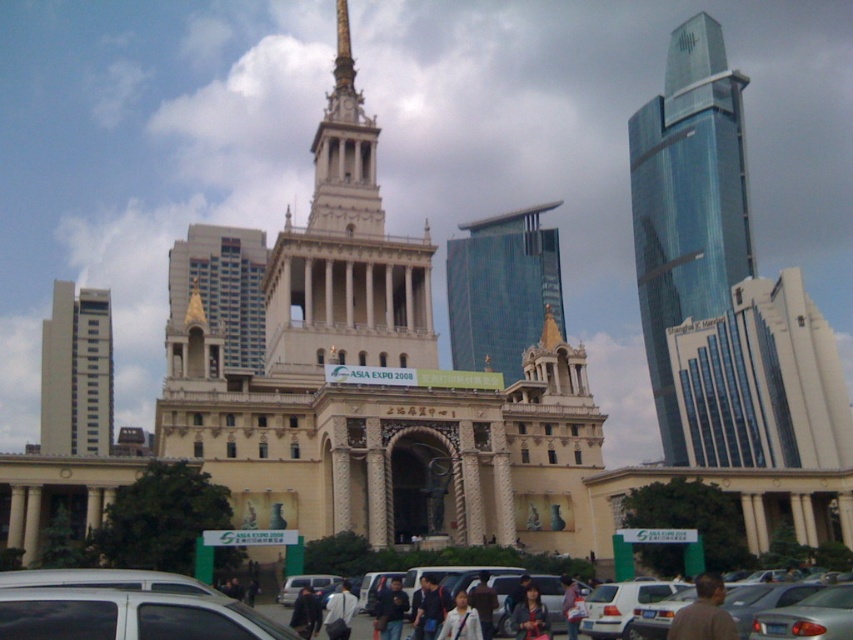
Question: Estimate the real-world distances between objects in this image. Which object is closer to the white shirt at center?

Choices:
 (A) white matte van at lower left
 (B) brown fabric jacket at center
 (C) silver metallic car at center

Answer: (B)

Question: Which of the following is the farthest from the observer?

Choices:
 (A) (200, 278)
 (B) (666, 378)
 (C) (683, 586)
 (D) (344, 1)

Answer: (A)

Question: Which point appears closest to the camera in this image?

Choices:
 (A) (730, 129)
 (B) (688, 604)
 (C) (572, 602)
 (D) (837, 605)

Answer: (D)

Question: Can you confirm if white matte van at lower left is wider than goldmaterial/texturespire at center?

Choices:
 (A) no
 (B) yes

Answer: (B)

Question: Is dark blue shirt at center positioned behind silver metallic van at center?

Choices:
 (A) yes
 (B) no

Answer: (B)

Question: Is light gray fabric jacket at center further to the viewer compared to brown fabric jacket at center?

Choices:
 (A) yes
 (B) no

Answer: (B)